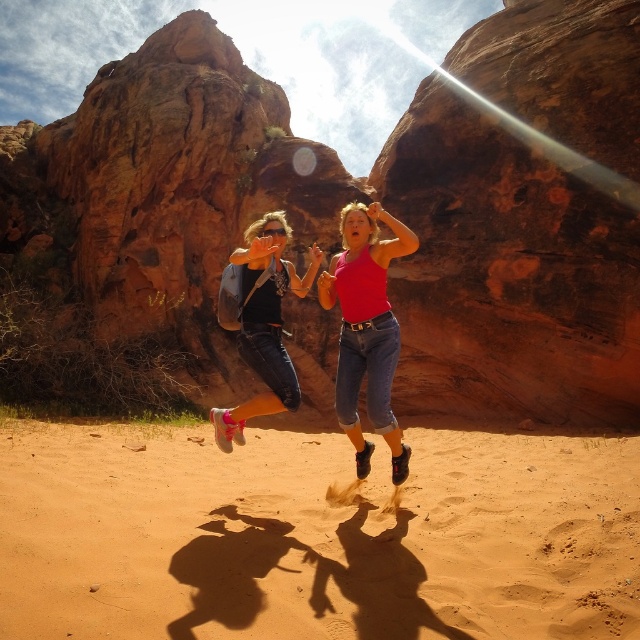
Looking at this image, you are standing at the origin point of the coordinate system in the desert scene. The rustic sandstone rock formation at center is located at coordinate point 0.312, 0.562. If you want to move directly towards it, which direction should you head?

Since the rustic sandstone rock formation at center is located at coordinate point (358, 198), you should head towards the center of the image to reach it.

You are a photographer trying to capture the perfect shot of the two people jumping in the desert. You need to ensure that both the matte pink tank top at center and denim jeans at center are clearly visible in the frame. Based on their sizes, which clothing item will appear taller in the photo?

The matte pink tank top at center will appear taller in the photo since it has a greater height compared to the denim jeans at center according to the description.

You are a photographer planning to capture a wide shot of the scene. Given the rustic sandstone rock formation at center and the matte pink tank top at center, which object would require more space in the frame to fully capture its width?

The rustic sandstone rock formation at center might be wider than the matte pink tank top at center, so it would require more space in the frame to fully capture its width.